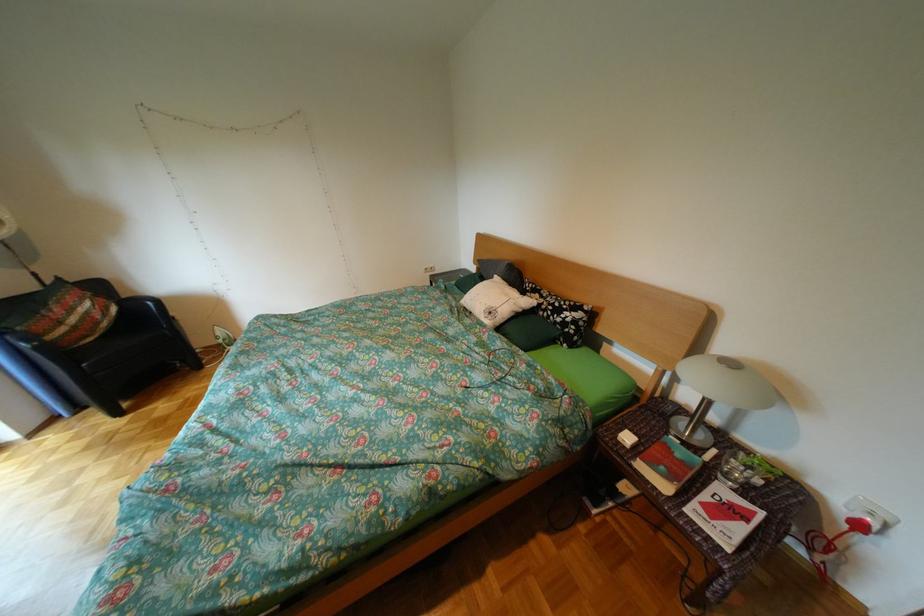
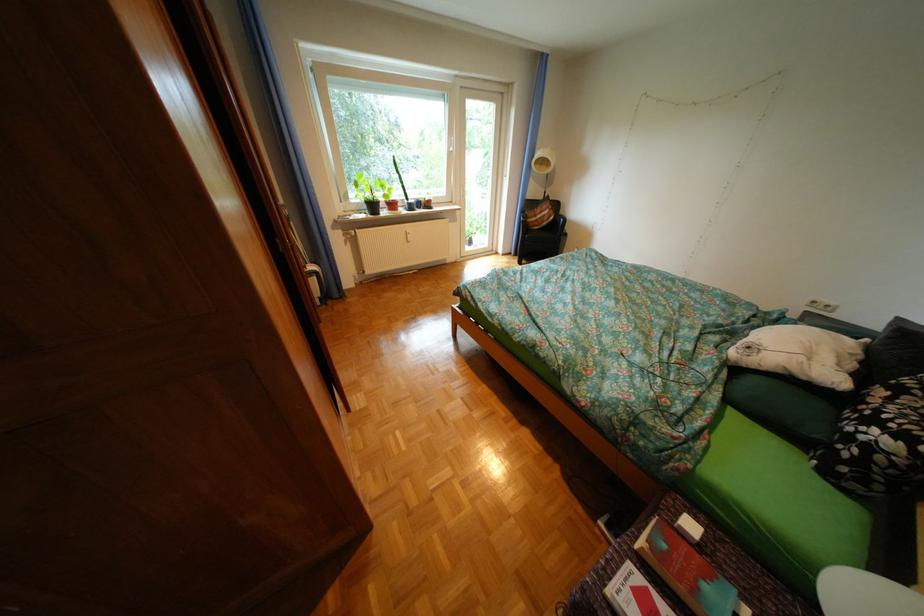
Find the pixel in the second image that matches (734,525) in the first image.

(642, 592)